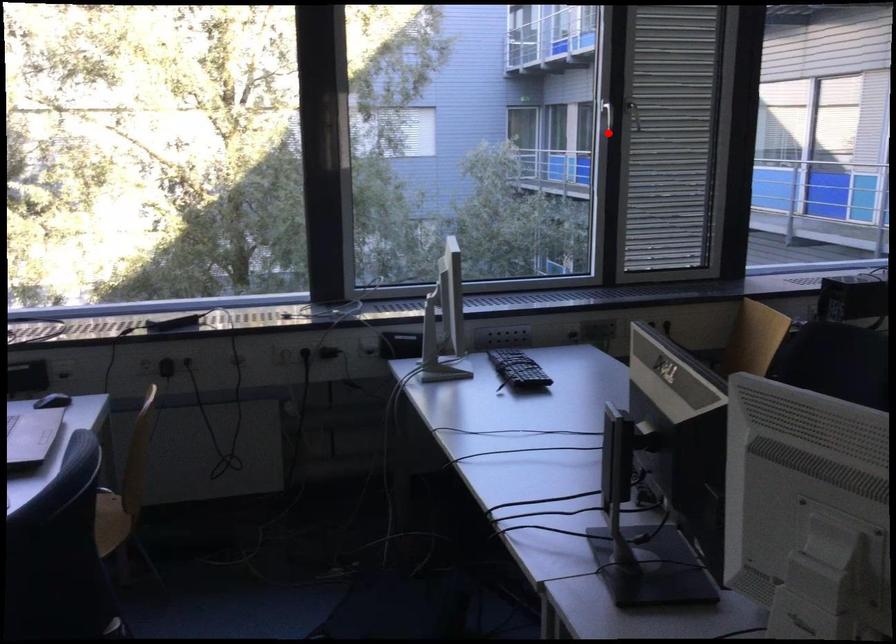
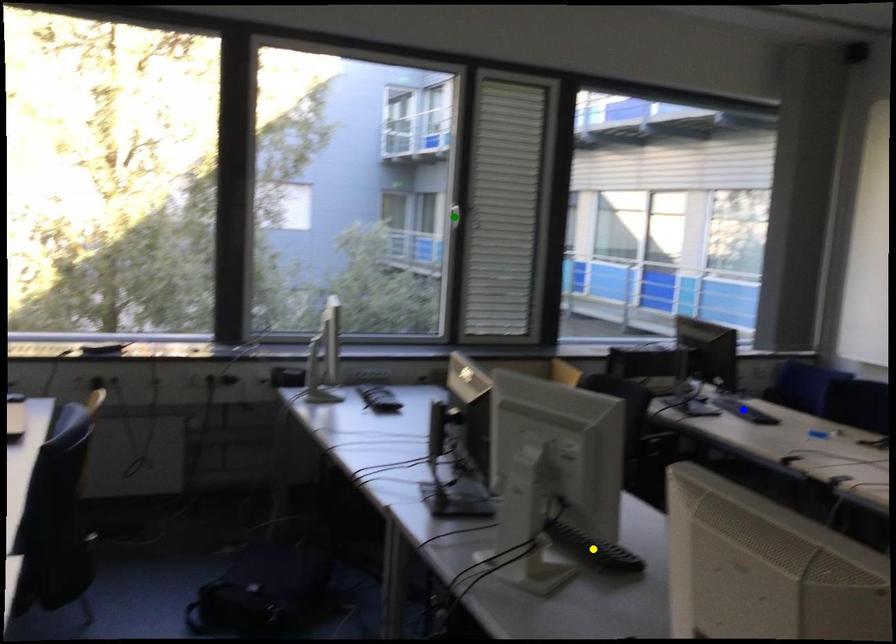
Question: I am providing you with two images of the same scene from different viewpoints. A red point is marked on the first image. You are given multiple points on the second image. Which mark in image 2 goes with the point in image 1?

Choices:
 (A) yellow point
 (B) blue point
 (C) green point

Answer: (C)